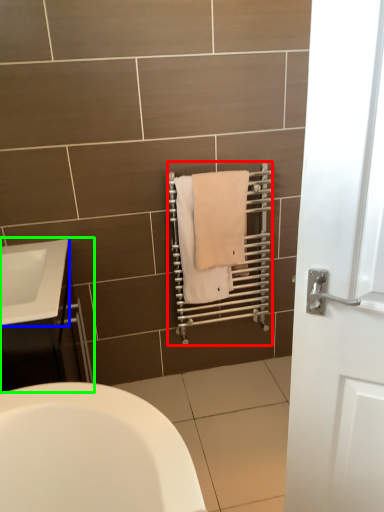
Question: Considering the real-world distances, which object is closest to balustrade (highlighted by a red box)? sink (highlighted by a blue box) or bathroom cabinet (highlighted by a green box).

Choices:
 (A) sink
 (B) bathroom cabinet

Answer: (B)